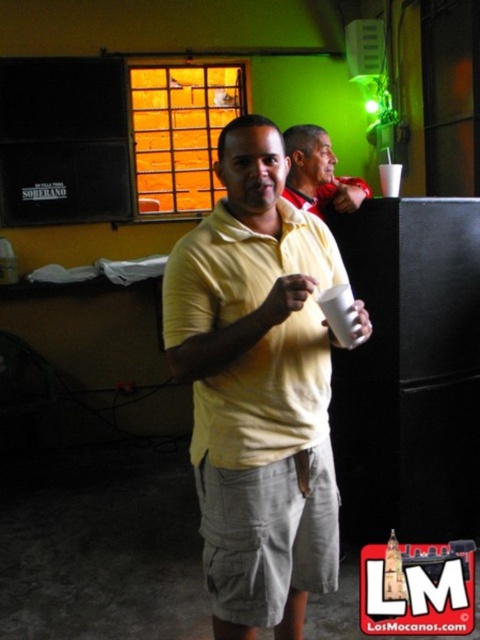
Who is positioned more to the right, yellow cotton shirt at center or yellow matte shirt at center?

yellow matte shirt at center is more to the right.

Can you confirm if yellow cotton shirt at center is smaller than yellow matte shirt at center?

Incorrect, yellow cotton shirt at center is not smaller in size than yellow matte shirt at center.

Find the location of a particular element. yellow cotton shirt at center is located at coordinates (257, 388).

The image size is (480, 640). What are the coordinates of `yellow cotton shirt at center` in the screenshot? It's located at (257, 388).